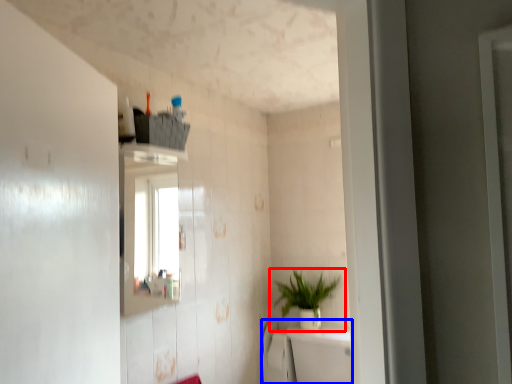
Question: Among these objects, which one is farthest to the camera, houseplant (highlighted by a red box) or bath (highlighted by a blue box)?

Choices:
 (A) houseplant
 (B) bath

Answer: (A)